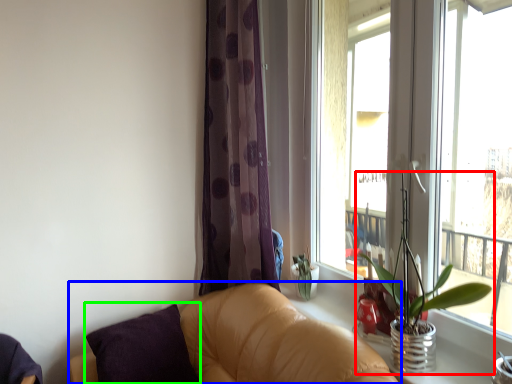
Question: Based on their relative distances, which object is nearer to houseplant (highlighted by a red box)? Choose from studio couch (highlighted by a blue box) and pillow (highlighted by a green box).

Choices:
 (A) studio couch
 (B) pillow

Answer: (A)